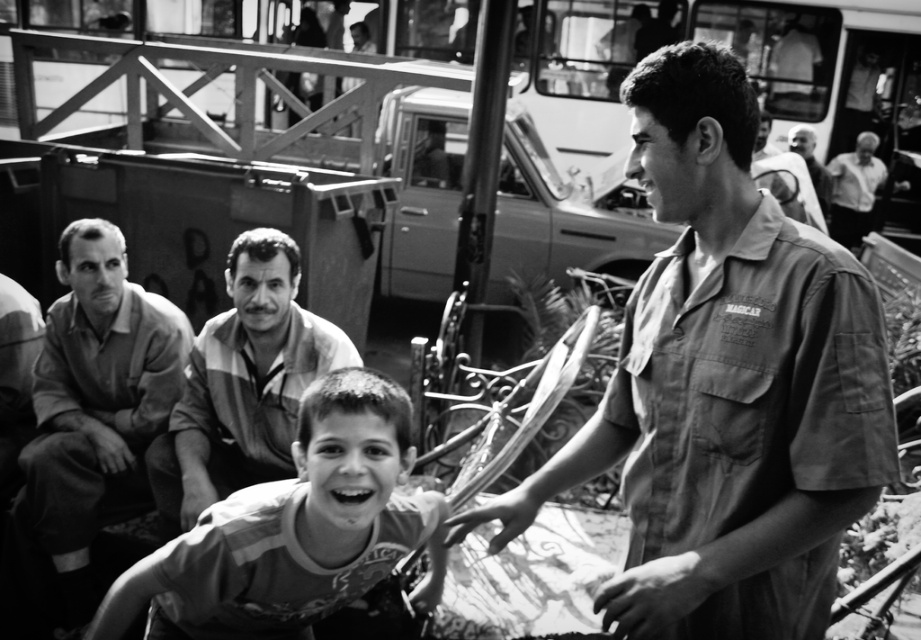
Based on the scene description, can you determine which object, the striped fabric shirt at center or the smooth skin face at upper right, is located more to the left side?

The striped fabric shirt at center is positioned on the left side of smooth skin face at upper right, so the striped fabric shirt at center is more to the left.

Consider the image. You are a photographer trying to capture a group photo of the striped fabric shirt at lower center and the smooth fabric shirt at left. The camera you are using has a maximum focus range of 5 feet. Can you fit both subjects into the frame without moving the camera?

The striped fabric shirt at lower center and smooth fabric shirt at left are 5.88 feet apart, which exceeds the camera maximum focus range of 5 feet. Therefore, you cannot fit both subjects into the frame without moving the camera.

In the scene, there is a smooth fabric shirt at center and a white cotton shirt at upper right. Which of these two shirts takes up more visual space in the image?

The white cotton shirt at upper right takes up more visual space because the smooth fabric shirt at center occupies less space than it.